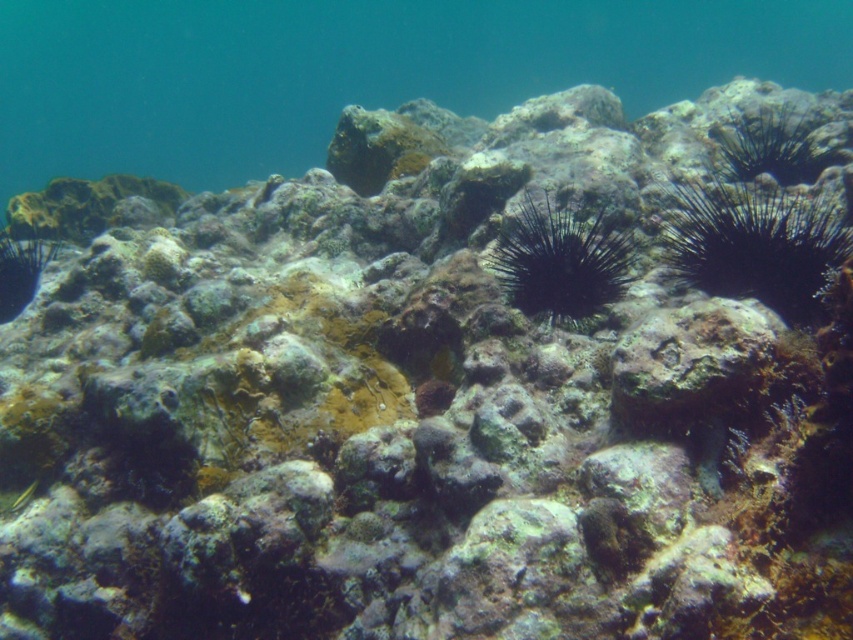
Is black spiny sea urchin at right above black spiny sea urchin at center?

Correct, black spiny sea urchin at right is located above black spiny sea urchin at center.

Which is more to the right, black spiny sea urchin at right or black spiny sea urchin at center?

black spiny sea urchin at right

Locate an element on the screen. The height and width of the screenshot is (640, 853). black spiny sea urchin at right is located at coordinates (753, 243).